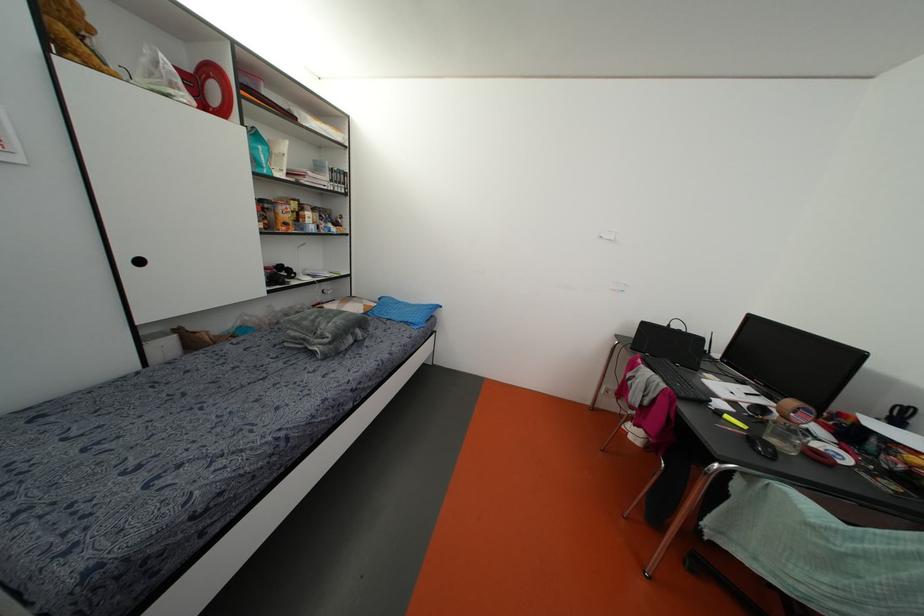
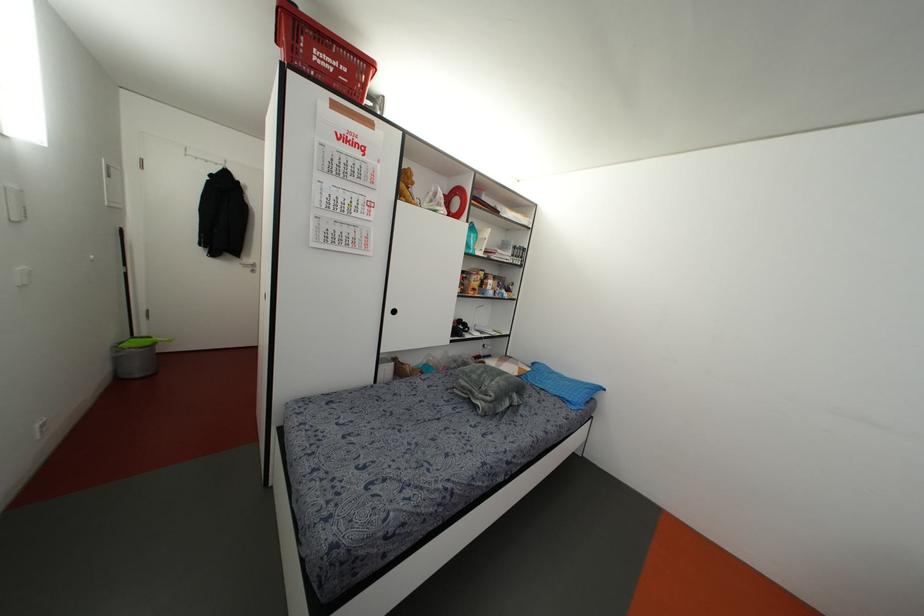
In the second image, find the point that corresponds to point 140,262 in the first image.

(394, 310)